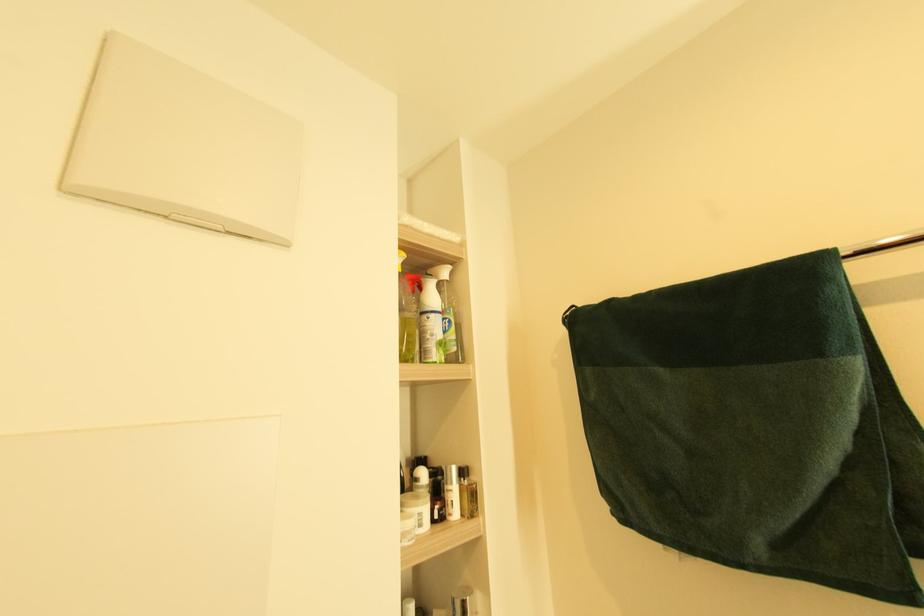
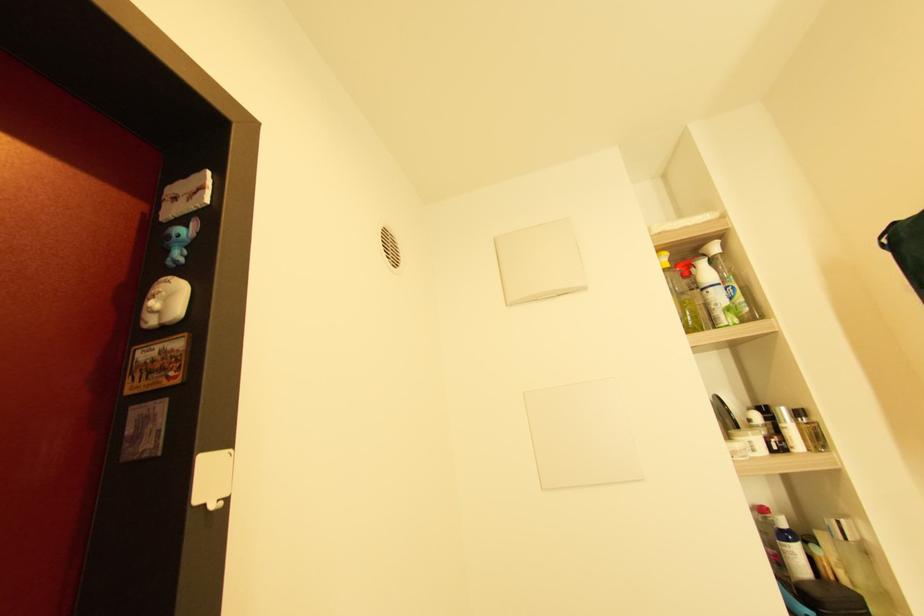
Question: The camera is either moving clockwise (left) or counter-clockwise (right) around the object. The first image is from the beginning of the video and the second image is from the end. Is the camera moving left or right when shooting the video?

Choices:
 (A) Left
 (B) Right

Answer: (B)